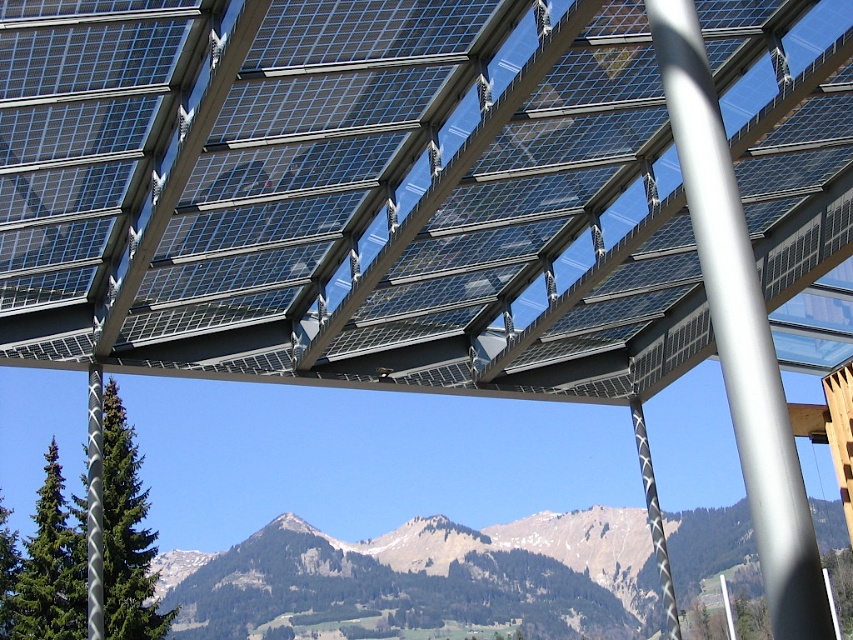
Looking at this image, is transparent glass solar panels at center to the right of silver textured pole at center from the viewer's perspective?

Indeed, transparent glass solar panels at center is positioned on the right side of silver textured pole at center.

Looking at this image, does transparent glass solar panels at center lie behind silver textured pole at center?

That is False.

Which is behind, point (648, 36) or point (99, 586)?

The point (99, 586) is behind.

Locate an element on the screen. This screenshot has height=640, width=853. transparent glass solar panels at center is located at coordinates (347, 195).

Between silver metallic pole at center and silver textured pole at center, which one is positioned higher?

Positioned higher is silver metallic pole at center.

Is silver metallic pole at center bigger than silver textured pole at center?

No.

In order to click on silver metallic pole at center in this screenshot , I will do `click(740, 326)`.

Locate an element on the screen. This screenshot has width=853, height=640. silver metallic pole at center is located at coordinates (740, 326).

Which of these two, silver textured pole at center or black textured pole at center, stands shorter?

silver textured pole at center is shorter.

Is silver textured pole at center bigger than black textured pole at center?

No, silver textured pole at center is not bigger than black textured pole at center.

At what (x,y) coordinates should I click in order to perform the action: click on silver textured pole at center. Please return your answer as a coordinate pair (x, y). The width and height of the screenshot is (853, 640). Looking at the image, I should click on pyautogui.click(x=94, y=506).